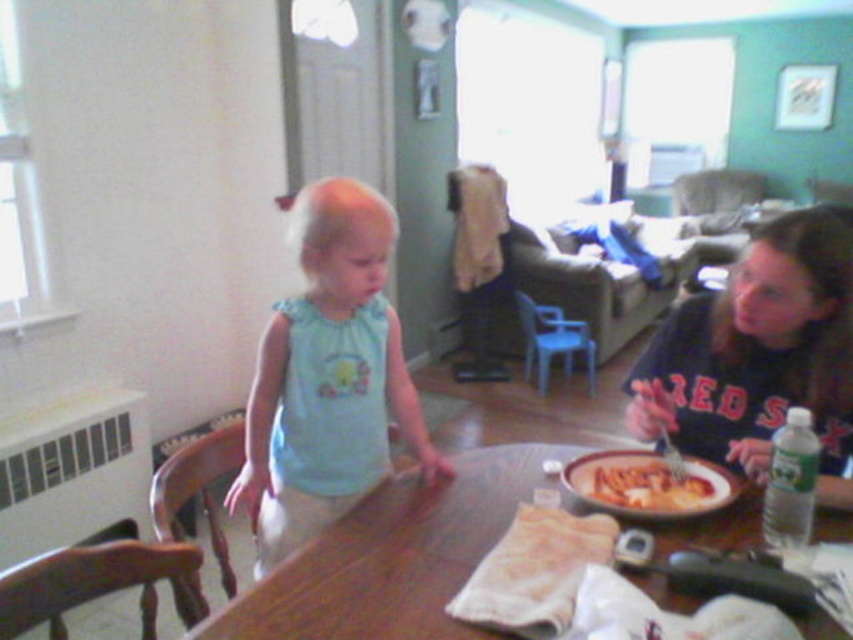
Question: From the image, what is the correct spatial relationship of light blue fabric at center in relation to matte plastic bowl at table center?

Choices:
 (A) left
 (B) right

Answer: (A)

Question: Which object is the farthest from the wooden table at center?

Choices:
 (A) light blue fabric at center
 (B) matte plastic bowl at table center
 (C) dark blue jersey at right

Answer: (C)

Question: Does light blue fabric at center have a smaller size compared to dark blue jersey at right?

Choices:
 (A) yes
 (B) no

Answer: (B)

Question: Can you confirm if wooden table at center is positioned to the right of dark blue jersey at right?

Choices:
 (A) no
 (B) yes

Answer: (A)

Question: Estimate the real-world distances between objects in this image. Which object is farther from the dark blue jersey at right?

Choices:
 (A) matte plastic bowl at table center
 (B) wooden table at center
 (C) light blue fabric at center

Answer: (C)

Question: Which object appears closest to the camera in this image?

Choices:
 (A) dark blue jersey at right
 (B) light blue fabric at center
 (C) matte plastic bowl at table center

Answer: (C)